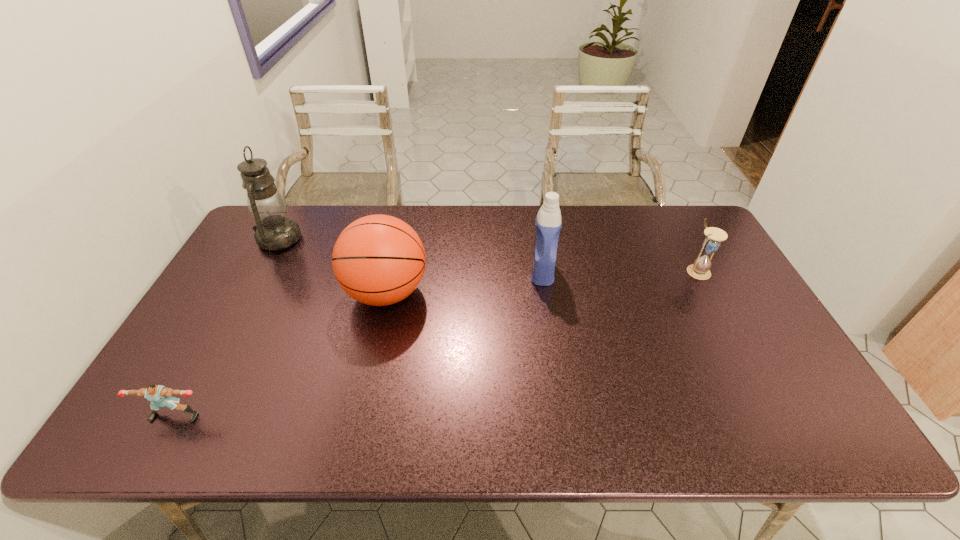
Identify the location of free space at the left edge of the desktop. (218, 327).

Image resolution: width=960 pixels, height=540 pixels. Identify the location of vacant position at the right edge of the desktop. (693, 284).

Locate an element on the screen. The image size is (960, 540). vacant space at the far left corner is located at coordinates (243, 244).

The image size is (960, 540). I want to click on vacant area between the nearest object and the basketball, so click(280, 354).

Locate an element on the screen. free space that is in between the detergent and the basketball is located at coordinates (465, 282).

Identify the location of vacant space that's between the basketball and the shortest object. The image size is (960, 540). (280, 354).

Where is `blank region between the detergent and the puncher`? The height and width of the screenshot is (540, 960). blank region between the detergent and the puncher is located at coordinates (359, 343).

You are a GUI agent. You are given a task and a screenshot of the screen. Output one action in this format:
    pyautogui.click(x=<x>, y=<y>)
    Task: Click on the unoccupied position between the nearest object and the tallest object
    This screenshot has width=960, height=540.
    Given the screenshot: What is the action you would take?
    pyautogui.click(x=227, y=327)

At what (x,y) coordinates should I click in order to perform the action: click on empty space that is in between the shortest object and the third object from right to left. Please return your answer as a coordinate pair (x, y). Looking at the image, I should click on (280, 354).

Locate an element on the screen. blank region between the puncher and the second object from right to left is located at coordinates (359, 343).